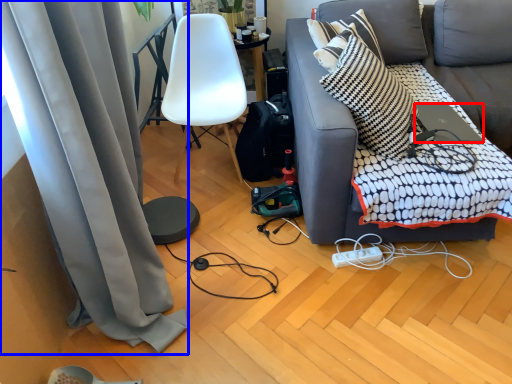
Question: Which of the following is the farthest to the observer, laptop (highlighted by a red box) or curtain (highlighted by a blue box)?

Choices:
 (A) laptop
 (B) curtain

Answer: (A)